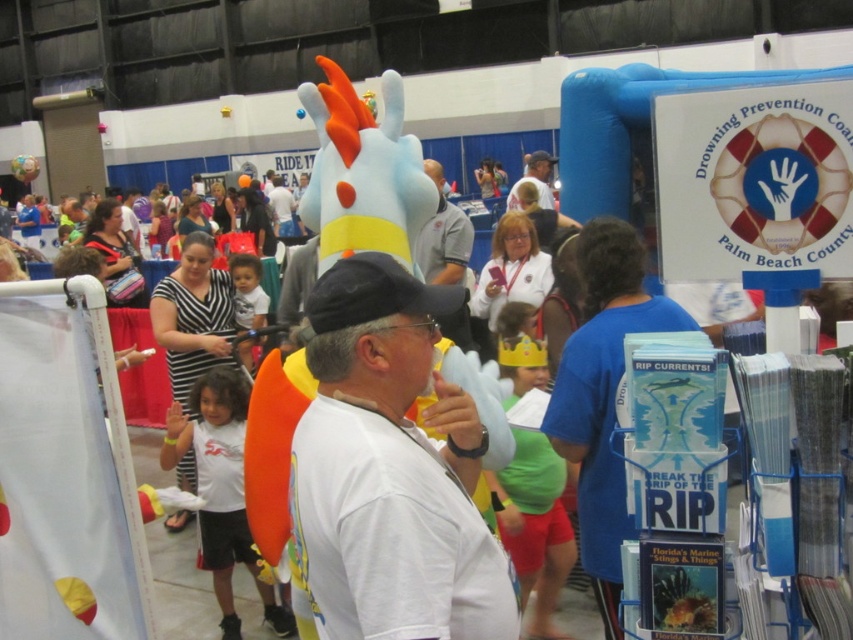
Question: Is white matte shirt at center thinner than gray fabric shirt at center?

Choices:
 (A) no
 (B) yes

Answer: (A)

Question: Which point appears farthest from the camera in this image?

Choices:
 (A) (465, 224)
 (B) (346, 275)

Answer: (A)

Question: Which point is farther to the camera?

Choices:
 (A) gray fabric shirt at center
 (B) white matte shirt at center

Answer: (A)

Question: Which object appears farthest from the camera in this image?

Choices:
 (A) white matte shirt at center
 (B) gray fabric shirt at center

Answer: (B)

Question: Can you confirm if white matte shirt at center is positioned above gray fabric shirt at center?

Choices:
 (A) yes
 (B) no

Answer: (B)

Question: Does white matte shirt at center have a greater width compared to gray fabric shirt at center?

Choices:
 (A) no
 (B) yes

Answer: (B)